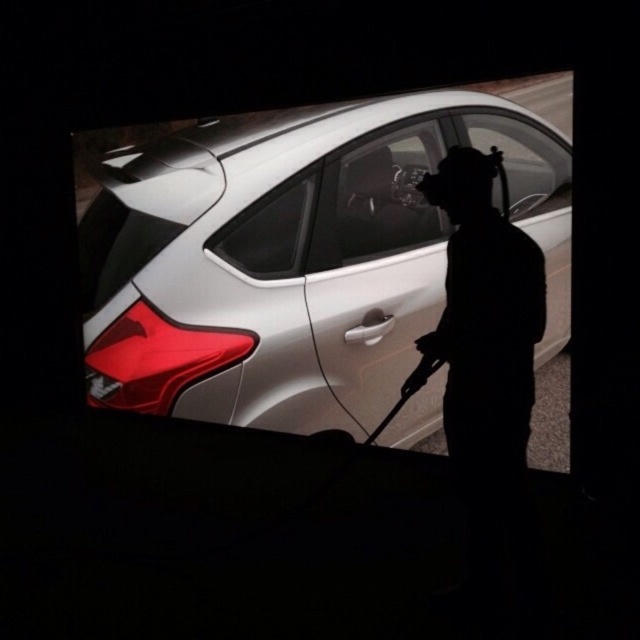
You are a delivery person who needs to place a package on the roof of the satin silver car at center. Can you do so without touching the clear glass window at center?

The satin silver car at center is positioned under the clear glass window at center, so placing the package on the roof of the satin silver car at center might risk touching the clear glass window at center. Check the distance between them first.

You are trying to determine if the silhouette figure at center can fit through the clear glass window at center. Based on their sizes, can they pass through?

The clear glass window at center is wider than the silhouette figure at center, so yes, the silhouette figure at center can fit through the clear glass window at center.